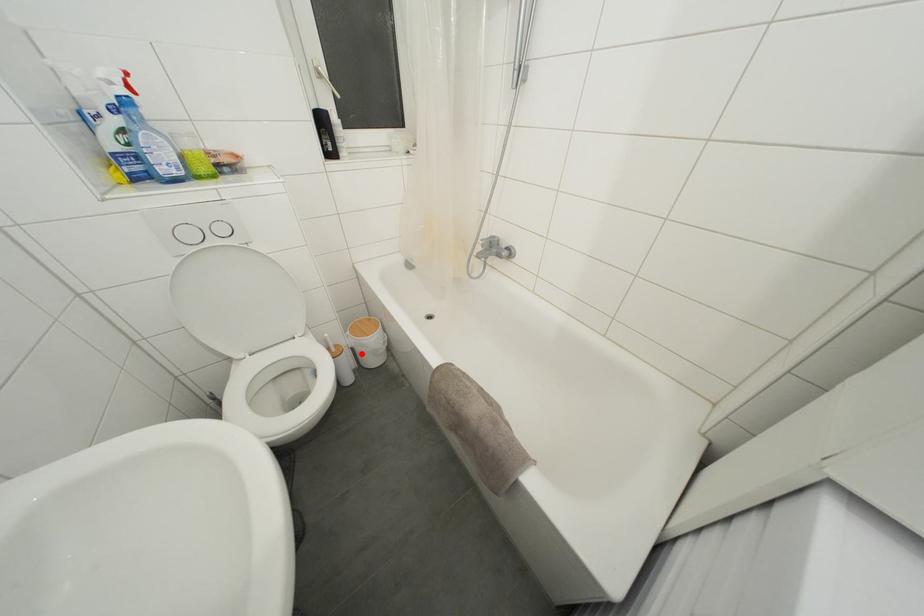
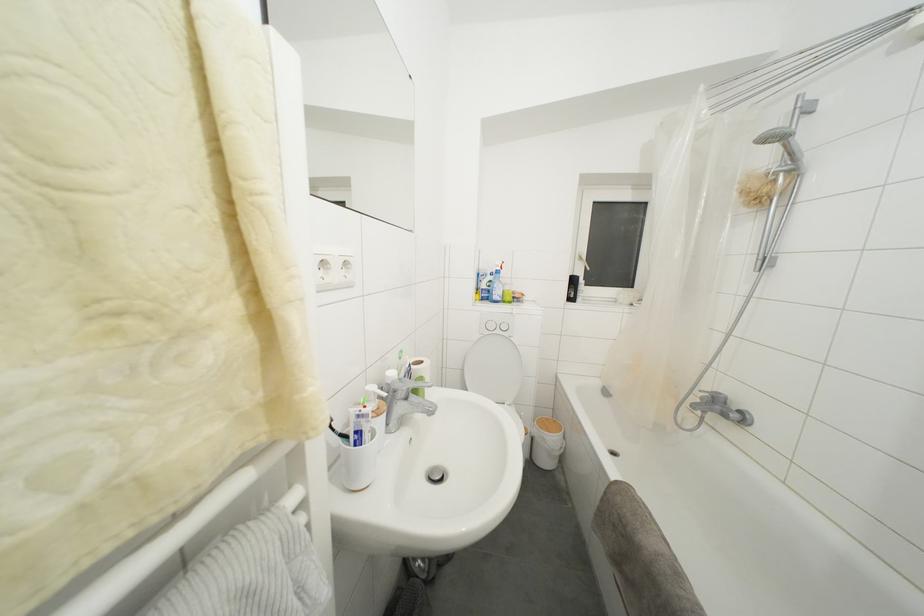
Where in the second image is the point corresponding to the highlighted location from the first image?

(541, 445)